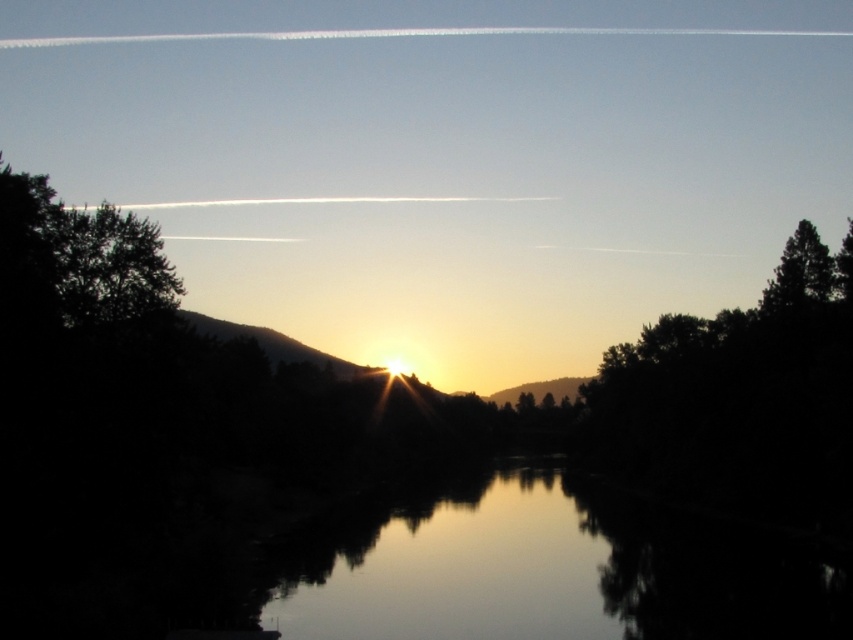
Question: Considering the relative positions of dark green leafy tree at left and dark green textured tree at right in the image provided, where is dark green leafy tree at left located with respect to dark green textured tree at right?

Choices:
 (A) right
 (B) left

Answer: (B)

Question: Among these points, which one is nearest to the camera?

Choices:
 (A) (88, 237)
 (B) (805, 292)

Answer: (A)

Question: Which point is farther from the camera taking this photo?

Choices:
 (A) (57, 244)
 (B) (805, 230)

Answer: (B)

Question: Does dark green leafy tree at left appear on the right side of dark green textured tree at right?

Choices:
 (A) no
 (B) yes

Answer: (A)

Question: Observing the image, what is the correct spatial positioning of dark green leafy tree at left in reference to dark green textured tree at right?

Choices:
 (A) below
 (B) above

Answer: (A)